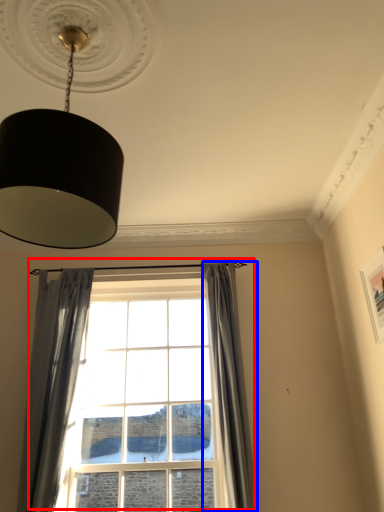
Question: Which object is closer to the camera taking this photo, window (highlighted by a red box) or curtain (highlighted by a blue box)?

Choices:
 (A) window
 (B) curtain

Answer: (B)